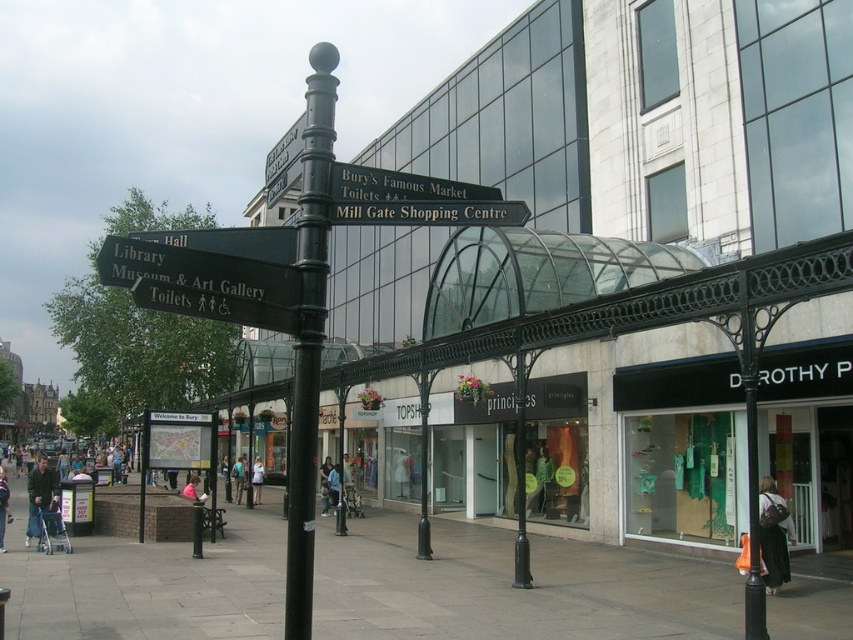
Question: Where is dark green jacket at lower left located in relation to light blue jeans at lower left in the image?

Choices:
 (A) left
 (B) right

Answer: (A)

Question: Is metallic green sign at upper center behind light blue jeans at lower left?

Choices:
 (A) yes
 (B) no

Answer: (B)

Question: Is dark gray backpack at lower right bigger than light blue jeans at lower left?

Choices:
 (A) yes
 (B) no

Answer: (B)

Question: Among these objects, which one is nearest to the camera?

Choices:
 (A) metallic green sign at upper center
 (B) black metal pole at center

Answer: (B)

Question: Which point is closer to the camera?

Choices:
 (A) (366, 173)
 (B) (33, 508)
 (C) (303, 570)
 (D) (129, 611)

Answer: (C)

Question: Among these objects, which one is nearest to the camera?

Choices:
 (A) matte brick building at left
 (B) light blue jeans at lower left
 (C) dark green jacket at lower left
 (D) light blue denim jeans at center

Answer: (B)